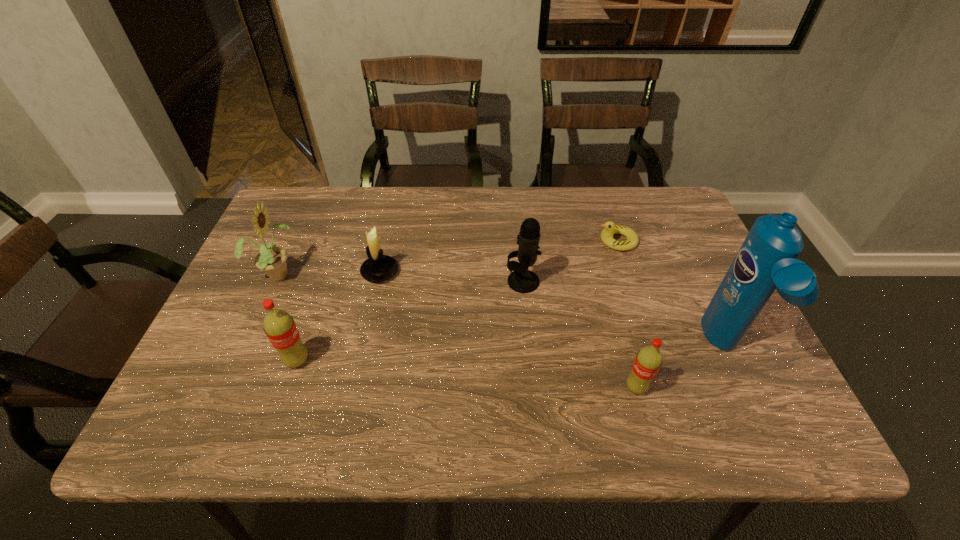
Identify the location of vacant area at the near right corner. This screenshot has width=960, height=540. (705, 385).

I want to click on free spot between the microphone and the farther soda, so click(410, 321).

The image size is (960, 540). I want to click on vacant space in between the shorter soda and the sunflower, so click(x=457, y=330).

At what (x,y) coordinates should I click in order to perform the action: click on vacant area that lies between the candle holder and the rightmost object. Please return your answer as a coordinate pair (x, y). This screenshot has height=540, width=960. Looking at the image, I should click on (552, 310).

Locate an element on the screen. This screenshot has height=540, width=960. free spot between the shortest object and the taller soda is located at coordinates (457, 301).

Locate an element on the screen. The image size is (960, 540). free space between the farthest object and the left soda is located at coordinates (457, 301).

Identify the location of vacant area that lies between the right soda and the candle holder. The width and height of the screenshot is (960, 540). (508, 329).

Find the location of `free point between the shampoo and the nearer soda`. free point between the shampoo and the nearer soda is located at coordinates (681, 368).

You are a GUI agent. You are given a task and a screenshot of the screen. Output one action in this format:
    pyautogui.click(x=<x>, y=<y>)
    Task: Click on the vacant area between the right soda and the second object from left to right
    The height and width of the screenshot is (540, 960).
    Given the screenshot: What is the action you would take?
    pyautogui.click(x=467, y=374)

Where is `blank region between the taller soda and the microphone`? This screenshot has width=960, height=540. blank region between the taller soda and the microphone is located at coordinates (410, 321).